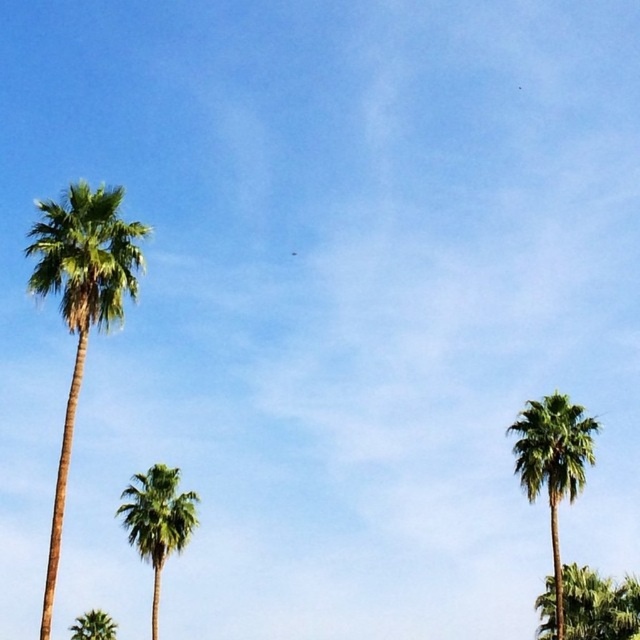
You are planning to install a small garden bench between the green leafy palm tree at right and the green leafy palm at center. The bench requires a minimum of 15 meters of space between the two trees to be placed safely. Based on the scene description, can the bench be installed between them?

The green leafy palm tree at right and green leafy palm at center are 17.54 meters apart, which exceeds the required 15 meters. Therefore, the bench can be installed safely between them.